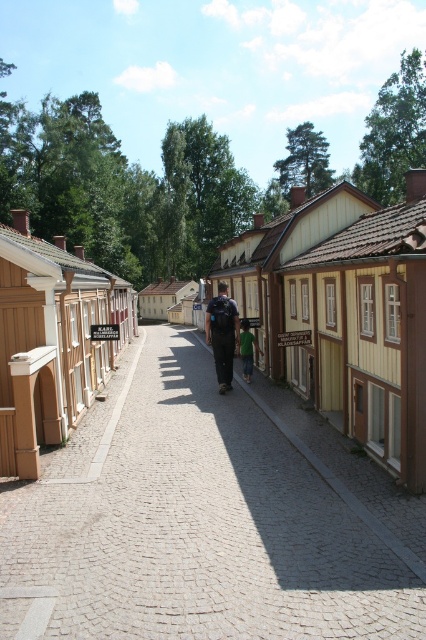
Question: Is brown wooden houses at center smaller than dark blue fabric backpack at center?

Choices:
 (A) yes
 (B) no

Answer: (B)

Question: Considering the real-world distances, which object is closest to the green fabric shirt at center?

Choices:
 (A) dark blue fabric backpack at center
 (B) cobblestone alley at center
 (C) brown wooden houses at center

Answer: (A)

Question: Which point appears farthest from the camera in this image?

Choices:
 (A) (229, 308)
 (B) (244, 323)

Answer: (B)

Question: Is cobblestone alley at center bigger than brown wooden houses at center?

Choices:
 (A) yes
 (B) no

Answer: (B)

Question: In this image, where is cobblestone alley at center located relative to dark blue fabric backpack at center?

Choices:
 (A) right
 (B) left

Answer: (B)

Question: Which is nearer to the brown wooden houses at center?

Choices:
 (A) dark blue fabric backpack at center
 (B) green fabric shirt at center

Answer: (A)